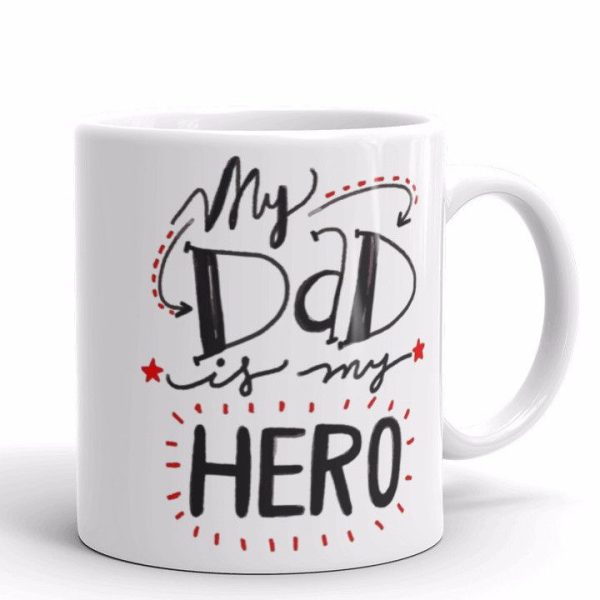
You are a GUI agent. You are given a task and a screenshot of the screen. Output one action in this format:
    pyautogui.click(x=<x>, y=<y>)
    Task: Click on the mug
    
    Given the screenshot: What is the action you would take?
    pyautogui.click(x=135, y=173)